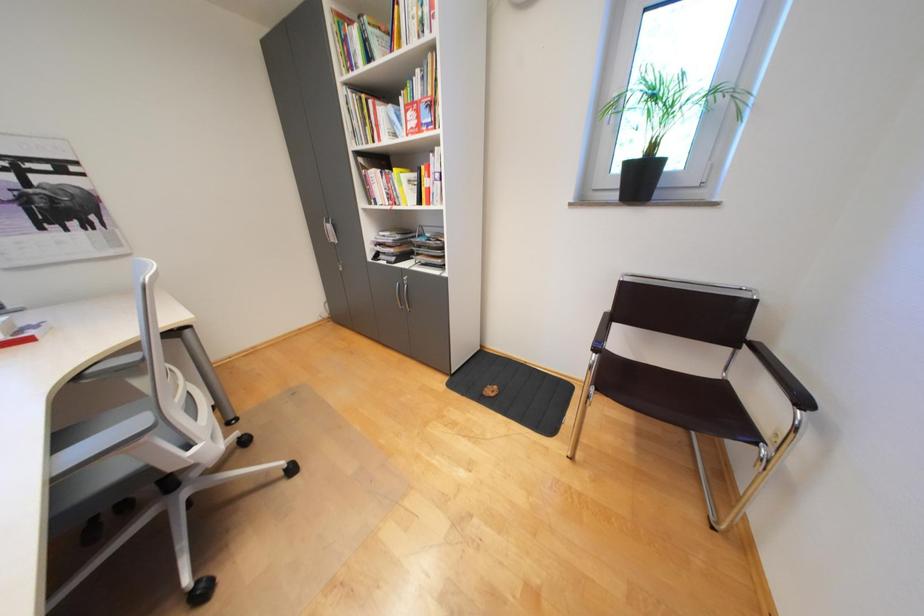
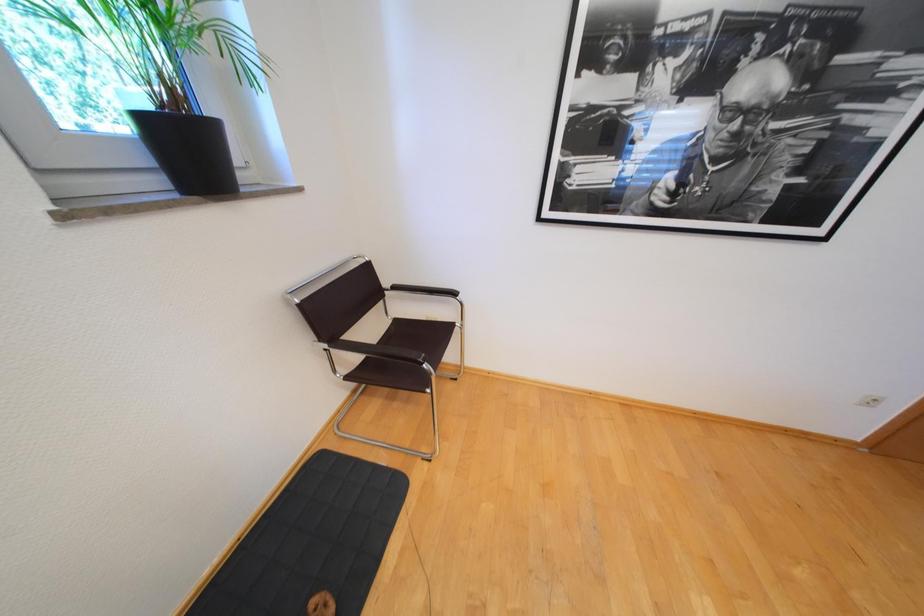
First-person continuous shooting, in which direction is the camera rotating?

The rotation direction of the camera is right-down.